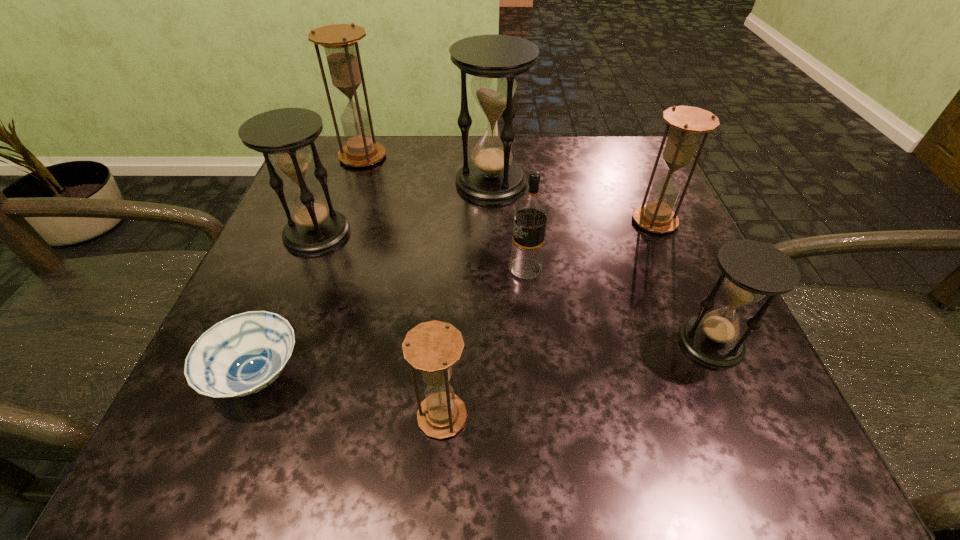
Locate an element on the screen. The width and height of the screenshot is (960, 540). free space located on the label of the vodka is located at coordinates (370, 268).

Where is `blank area located on the label of the vodka`? This screenshot has height=540, width=960. blank area located on the label of the vodka is located at coordinates (439, 268).

Find the location of a particular element. This screenshot has width=960, height=540. free space located 0.140m on the right of the nearest brown hourglass is located at coordinates (575, 416).

Where is `vacant space located 0.150m on the left of the rightmost black hourglass`? Image resolution: width=960 pixels, height=540 pixels. vacant space located 0.150m on the left of the rightmost black hourglass is located at coordinates (579, 342).

The height and width of the screenshot is (540, 960). I want to click on blank space located on the right of the blue soup bowl, so click(442, 376).

Image resolution: width=960 pixels, height=540 pixels. What are the coordinates of `hourglass present at the near edge` in the screenshot? It's located at (432, 347).

Where is `soup bowl that is at the near edge`? soup bowl that is at the near edge is located at coordinates (243, 354).

Identify the location of soup bowl positioned at the left edge. The width and height of the screenshot is (960, 540). (243, 354).

Find the location of `object located at the far left corner`. object located at the far left corner is located at coordinates (340, 43).

This screenshot has width=960, height=540. I want to click on object located at the near left corner, so click(x=243, y=354).